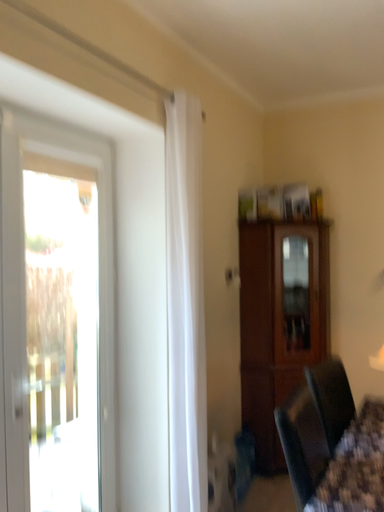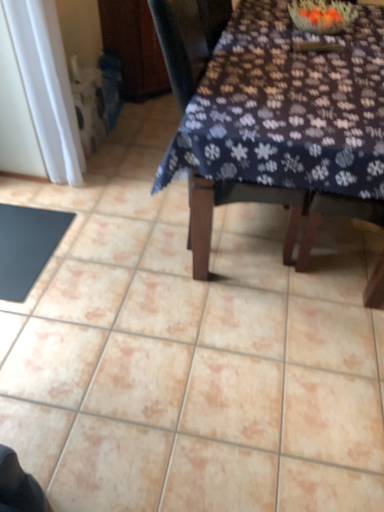
Question: Which way did the camera rotate in the video?

Choices:
 (A) rotated left
 (B) rotated right

Answer: (B)